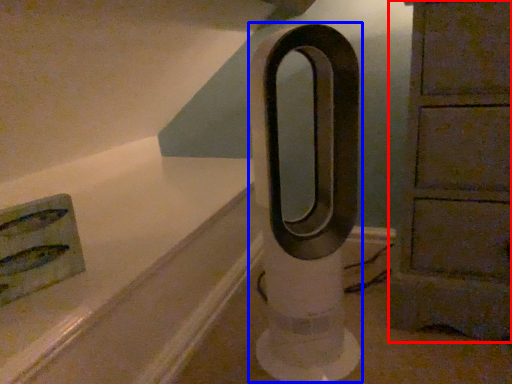
Question: Which of the following is the farthest to the observer, furniture (highlighted by a red box) or pillar (highlighted by a blue box)?

Choices:
 (A) furniture
 (B) pillar

Answer: (A)